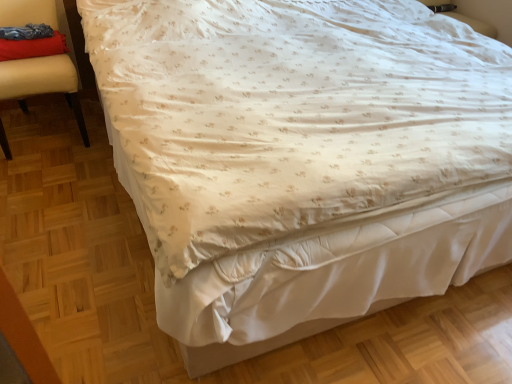
Question: Which is correct: velvet red pillow at upper left is inside velvet red cushion at left, or outside of it?

Choices:
 (A) inside
 (B) outside

Answer: (A)

Question: Considering the positions of point (27, 56) and point (55, 26), is point (27, 56) closer or farther from the camera than point (55, 26)?

Choices:
 (A) closer
 (B) farther

Answer: (A)

Question: Relative to velvet red cushion at left, is velvet red pillow at upper left in front or behind?

Choices:
 (A) behind
 (B) front

Answer: (A)

Question: Does point (9, 82) appear closer or farther from the camera than point (57, 41)?

Choices:
 (A) farther
 (B) closer

Answer: (B)

Question: From the image's perspective, is velvet red cushion at left positioned above or below velvet red pillow at upper left?

Choices:
 (A) below
 (B) above

Answer: (A)

Question: Is velvet red cushion at left inside or outside of velvet red pillow at upper left?

Choices:
 (A) inside
 (B) outside

Answer: (B)

Question: Is velvet red cushion at left to the left or to the right of velvet red pillow at upper left in the image?

Choices:
 (A) right
 (B) left

Answer: (B)